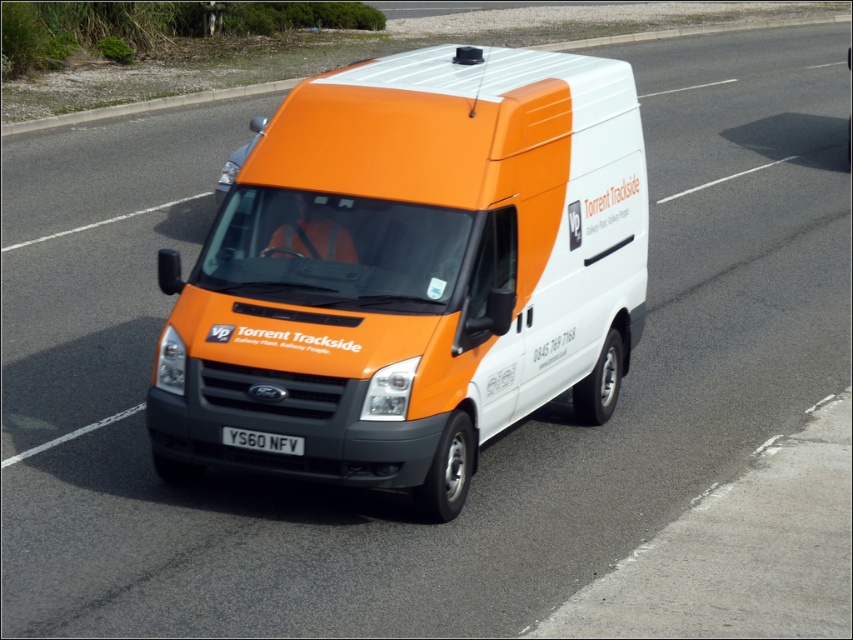
Can you confirm if orange matte van at center is shorter than black metal license plate at center?

No, orange matte van at center is not shorter than black metal license plate at center.

At what (x,y) coordinates should I click in order to perform the action: click on orange matte van at center. Please return your answer as a coordinate pair (x, y). Image resolution: width=853 pixels, height=640 pixels. Looking at the image, I should click on (410, 272).

Where is `orange matte van at center`? This screenshot has height=640, width=853. orange matte van at center is located at coordinates (410, 272).